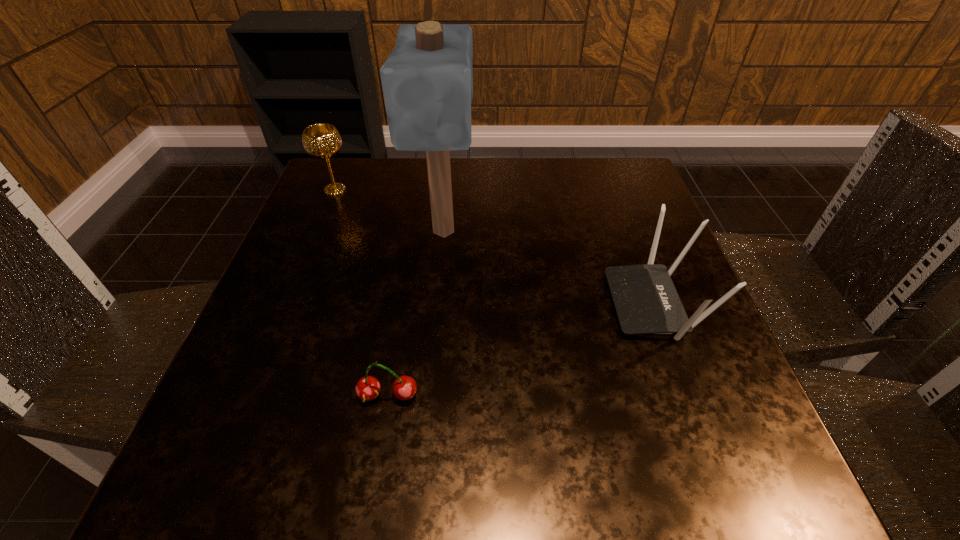
Where is `mallet`? The width and height of the screenshot is (960, 540). mallet is located at coordinates (427, 80).

At what (x,y) coordinates should I click in order to perform the action: click on chalice. Please return your answer as a coordinate pair (x, y). Image resolution: width=960 pixels, height=540 pixels. Looking at the image, I should click on [321, 141].

The image size is (960, 540). I want to click on the farthest object, so click(321, 141).

The height and width of the screenshot is (540, 960). In order to click on the rightmost object in this screenshot , I will do `click(646, 302)`.

This screenshot has height=540, width=960. What are the coordinates of `the nearest object` in the screenshot? It's located at (368, 388).

Image resolution: width=960 pixels, height=540 pixels. Identify the location of cherry. (368, 388).

Where is `free space located 0.180m on the front of the mallet`? Image resolution: width=960 pixels, height=540 pixels. free space located 0.180m on the front of the mallet is located at coordinates (434, 340).

You are a GUI agent. You are given a task and a screenshot of the screen. Output one action in this format:
    pyautogui.click(x=<x>, y=<y>)
    Task: Click on the vacant space located 0.110m on the back of the farthest object
    
    Given the screenshot: What is the action you would take?
    pyautogui.click(x=348, y=157)

This screenshot has width=960, height=540. In order to click on vacant space located on the front-facing side of the rightmost object in this screenshot , I will do `click(440, 303)`.

The height and width of the screenshot is (540, 960). Identify the location of vacant position located on the front-facing side of the rightmost object. (456, 303).